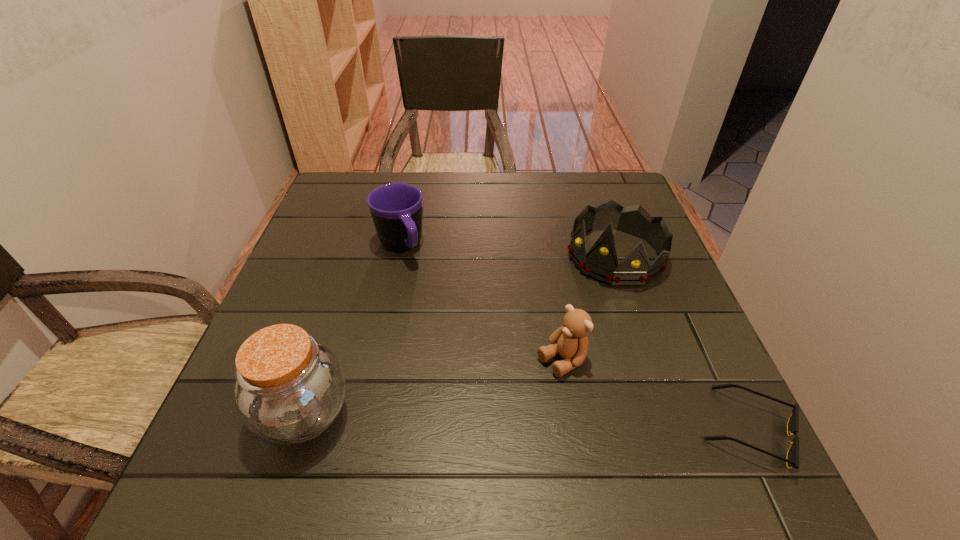
What are the coordinates of `object situated at the near left corner` in the screenshot? It's located at (289, 389).

The width and height of the screenshot is (960, 540). I want to click on object present at the near right corner, so click(792, 460).

Locate an element on the screen. free space at the far edge is located at coordinates (477, 217).

At what (x,y) coordinates should I click in order to perform the action: click on free space at the left edge. Please return your answer as a coordinate pair (x, y). The image size is (960, 540). Looking at the image, I should click on (352, 218).

I want to click on free region at the right edge of the desktop, so click(x=703, y=356).

Find the location of a particular element. Image resolution: width=960 pixels, height=540 pixels. blank space at the near right corner is located at coordinates (673, 437).

Locate an element on the screen. The image size is (960, 540). free space that is in between the sunglasses and the jar is located at coordinates (526, 422).

At what (x,y) coordinates should I click in order to perform the action: click on free spot between the mug and the jar. Please return your answer as a coordinate pair (x, y). This screenshot has width=960, height=540. Looking at the image, I should click on (352, 330).

I want to click on empty space between the jar and the shortest object, so click(526, 422).

What are the coordinates of `vacant area that lies between the tiara and the jar` in the screenshot? It's located at (460, 335).